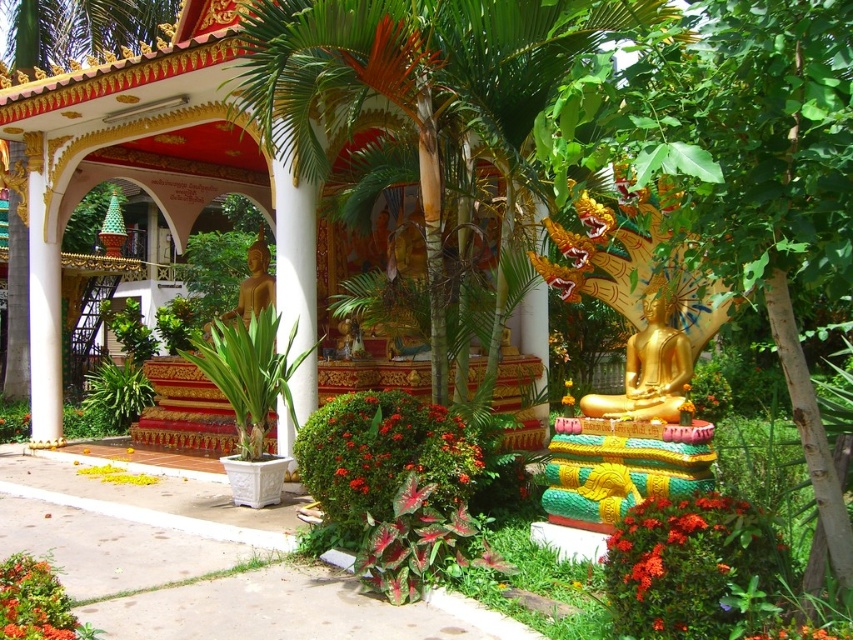
Question: Which of the following is the closest to the observer?

Choices:
 (A) bright orange flowers at lower right
 (B) orange fabric garland at center
 (C) gold polished statue at center

Answer: (A)

Question: Which point is farther to the camera?

Choices:
 (A) (421, 161)
 (B) (569, 403)
 (C) (55, 627)

Answer: (A)

Question: Considering the real-world distances, which object is farthest from the orange fabric garland at center?

Choices:
 (A) gold polished statue at center
 (B) gold polished statue at center right

Answer: (A)

Question: Is bright orange flowers at lower right below bright orange petals at lower left?

Choices:
 (A) no
 (B) yes

Answer: (A)

Question: Can you confirm if green leafy palm tree at center is thinner than gold polished statue at center?

Choices:
 (A) no
 (B) yes

Answer: (A)

Question: Is bright orange flowers at lower right to the right of gold polished statue at center right from the viewer's perspective?

Choices:
 (A) yes
 (B) no

Answer: (B)